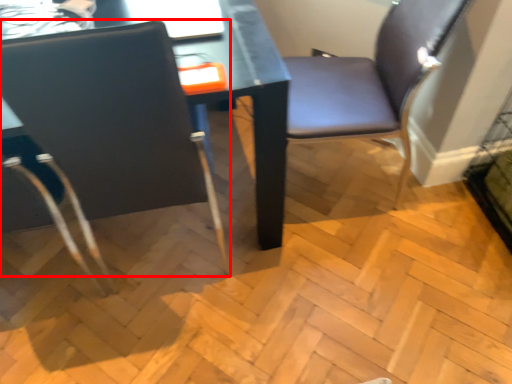
Question: In this image, where is chair (annotated by the red box) located relative to chair?

Choices:
 (A) right
 (B) left

Answer: (B)